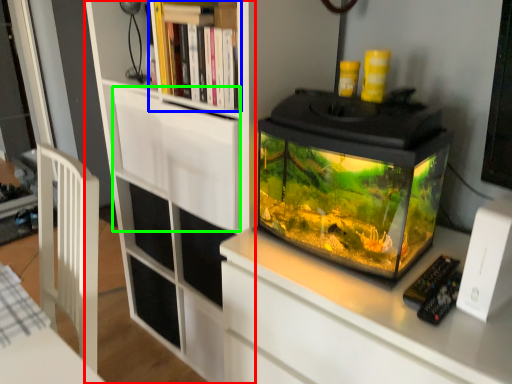
Question: Based on their relative distances, which object is nearer to bookcase (highlighted by a red box)? Choose from shelf (highlighted by a blue box) and drawer (highlighted by a green box).

Choices:
 (A) shelf
 (B) drawer

Answer: (B)